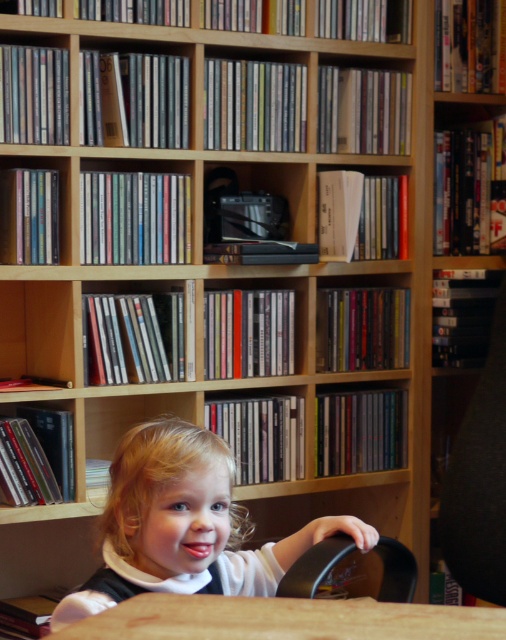
Is blonde hair toddler at center below black plastic chair at lower center?

No, blonde hair toddler at center is not below black plastic chair at lower center.

Does blonde hair toddler at center have a lesser height compared to black plastic chair at lower center?

No.

Between point (114, 516) and point (317, 564), which one is positioned in front?

Point (114, 516)

Image resolution: width=506 pixels, height=640 pixels. In order to click on blonde hair toddler at center in this screenshot , I will do `click(185, 525)`.

Is point (371, 600) less distant than point (314, 593)?

No, it is not.

Does point (153, 632) come behind point (400, 554)?

That is False.

This screenshot has width=506, height=640. Identify the location of brown wooden table at lower center. (283, 620).

Is blonde hair toddler at center to the left of brown wooden table at lower center from the viewer's perspective?

Correct, you'll find blonde hair toddler at center to the left of brown wooden table at lower center.

From the picture: Between blonde hair toddler at center and brown wooden table at lower center, which one appears on the right side from the viewer's perspective?

brown wooden table at lower center is more to the right.

Does point (145, 541) come farther from viewer compared to point (365, 620)?

That is True.

What are the coordinates of `blonde hair toddler at center` in the screenshot? It's located at (185, 525).